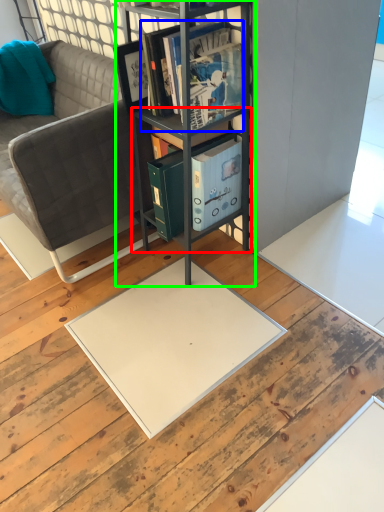
Question: Which object is positioned closest to cabinet (highlighted by a red box)? Select from book (highlighted by a blue box) and shelf (highlighted by a green box).

Choices:
 (A) book
 (B) shelf

Answer: (B)